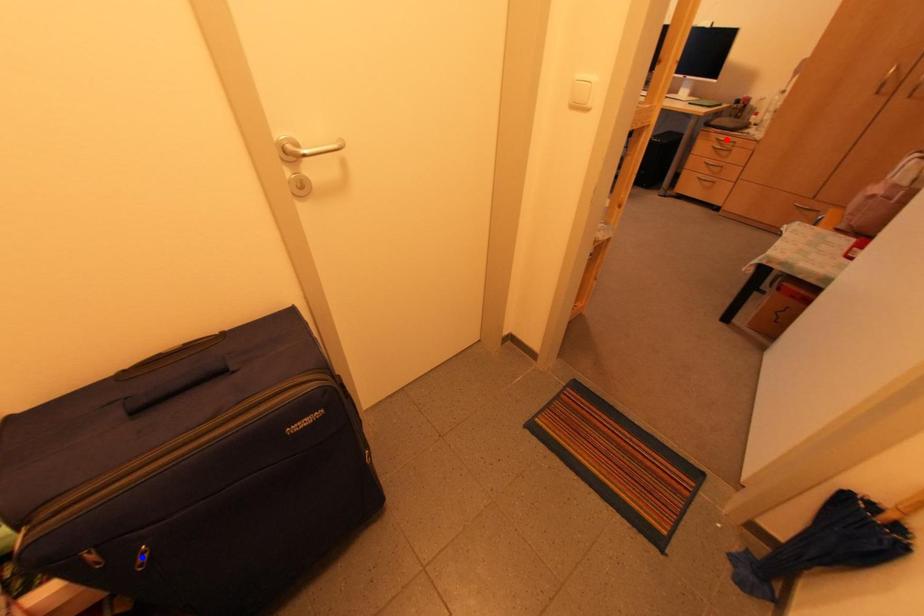
Question: In the image, two points are highlighted. Which point is nearer to the camera? Reply with the corresponding letter.

Choices:
 (A) blue point
 (B) red point

Answer: (A)